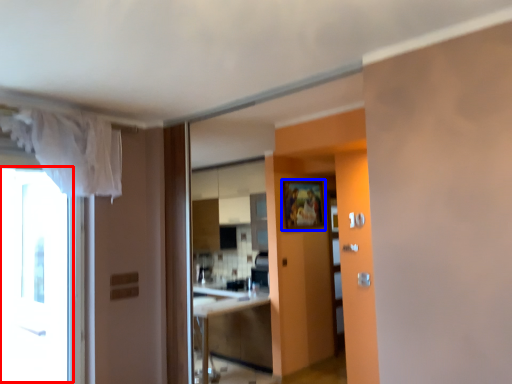
Question: Among these objects, which one is farthest to the camera, window (highlighted by a red box) or picture frame (highlighted by a blue box)?

Choices:
 (A) window
 (B) picture frame

Answer: (B)